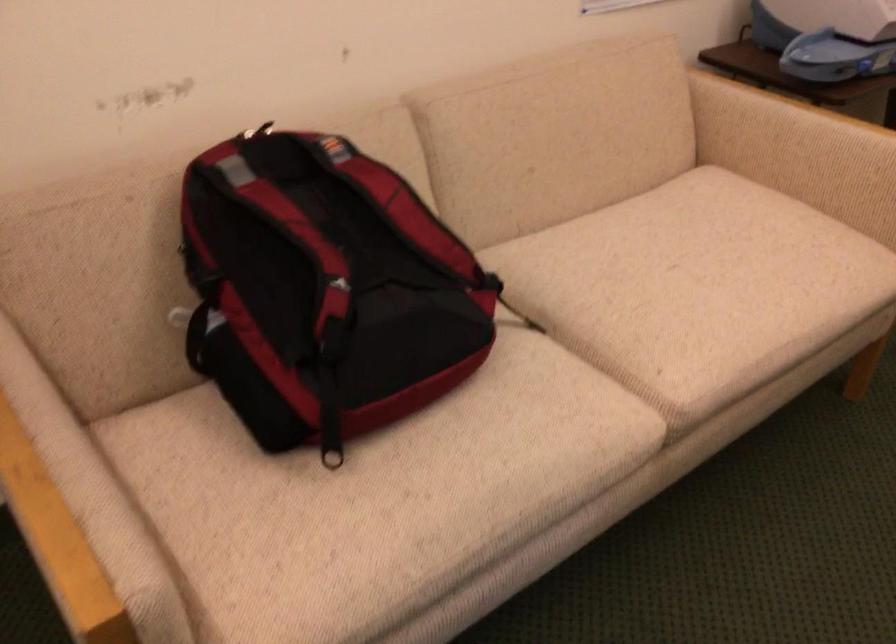
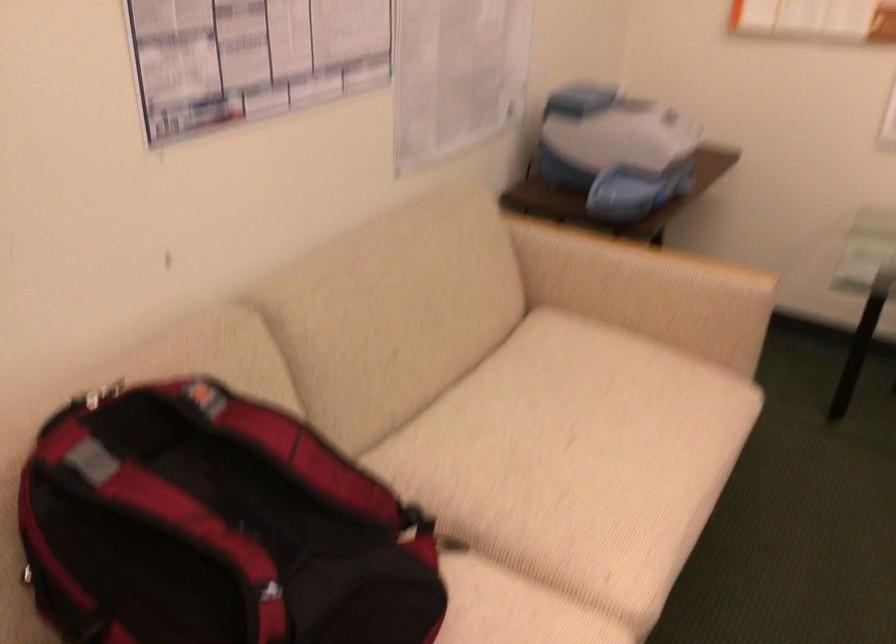
Question: How did the camera likely rotate?

Choices:
 (A) Left
 (B) Right
 (C) Up
 (D) Down

Answer: (B)